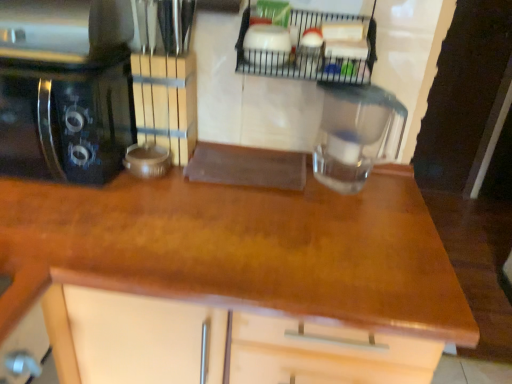
Where is `vacant space to the right of transparent glass jar at center`? This screenshot has height=384, width=512. vacant space to the right of transparent glass jar at center is located at coordinates (400, 193).